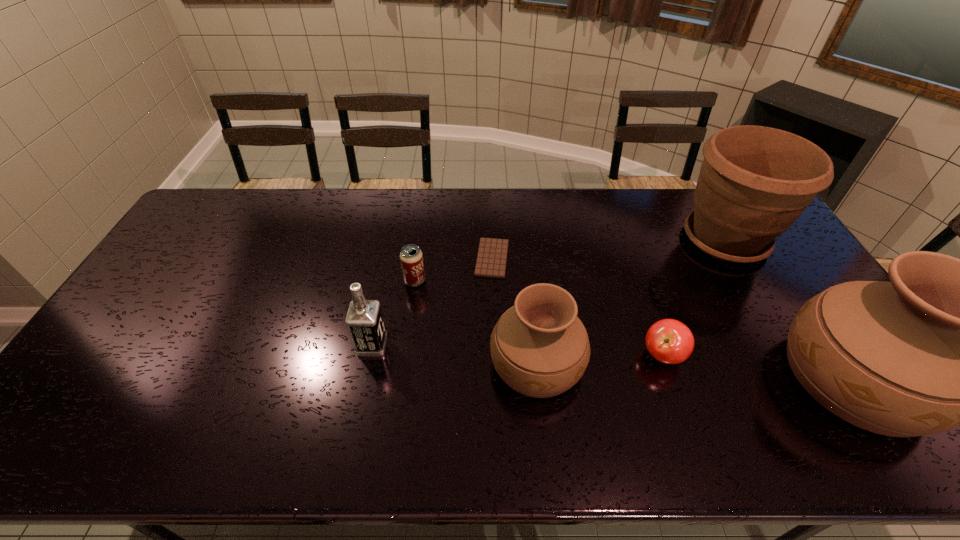
Select which object appears as the fifth closest to the apple. Please provide its 2D coordinates. Your answer should be formatted as a tuple, i.e. [(x, y)], where the tuple contains the x and y coordinates of a point satisfying the conditions above.

[(411, 258)]

Image resolution: width=960 pixels, height=540 pixels. In order to click on object that ranks as the sixth closest to the sixth object from right to left in this screenshot , I will do [x=947, y=342].

Where is `free space that satisfies the following two spatial constraints: 1. on the back side of the left urn; 2. on the front label of the leftmost object`? This screenshot has width=960, height=540. free space that satisfies the following two spatial constraints: 1. on the back side of the left urn; 2. on the front label of the leftmost object is located at coordinates (535, 345).

This screenshot has width=960, height=540. In order to click on vacant point that satisfies the following two spatial constraints: 1. on the back side of the apple; 2. on the left side of the shorter urn in this screenshot , I will do pos(536,355).

Identify the location of free space in the image that satisfies the following two spatial constraints: 1. on the front side of the beer can; 2. on the front label of the vodka. This screenshot has height=540, width=960. (406, 345).

Locate an element on the screen. The image size is (960, 540). free location that satisfies the following two spatial constraints: 1. on the front side of the left urn; 2. on the left side of the shortest object is located at coordinates (495, 363).

Identify the location of free space that satisfies the following two spatial constraints: 1. on the back side of the fifth object from left to right; 2. on the front label of the leftmost object. This screenshot has width=960, height=540. (660, 345).